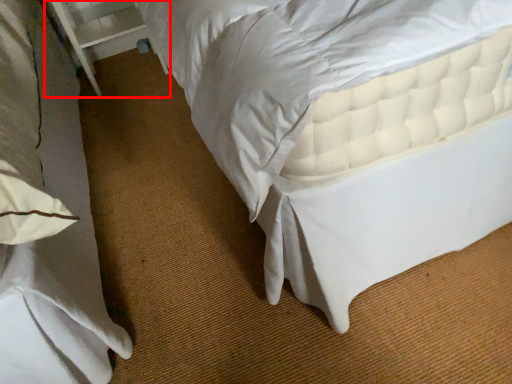
Question: From the image's perspective, where is balustrade (annotated by the red box) located in relation to bed in the image?

Choices:
 (A) below
 (B) above

Answer: (B)